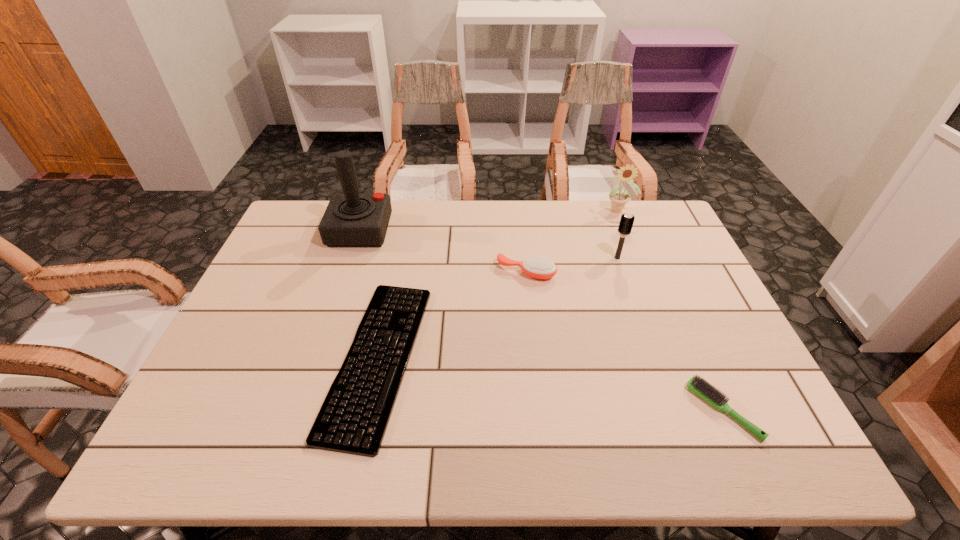
I want to click on blank space located on the front-facing side of the fifth shortest object, so click(x=637, y=258).

This screenshot has height=540, width=960. In order to click on vacant space situated 0.300m on the left of the third tallest object in this screenshot , I will do `click(512, 258)`.

Where is `vacant position located 0.160m on the back of the leftmost hairbrush`? Image resolution: width=960 pixels, height=540 pixels. vacant position located 0.160m on the back of the leftmost hairbrush is located at coordinates (521, 229).

I want to click on free space located 0.350m on the left of the shortest hairbrush, so click(x=534, y=410).

Locate an element on the screen. blank space located 0.330m on the back of the computer keyboard is located at coordinates (407, 219).

This screenshot has width=960, height=540. What are the coordinates of `joystick located at the far edge` in the screenshot? It's located at (351, 219).

The width and height of the screenshot is (960, 540). Find the location of `sunflower situated at the far edge`. sunflower situated at the far edge is located at coordinates (618, 199).

Find the location of `hairbrush that is positioned at the near edge`. hairbrush that is positioned at the near edge is located at coordinates (704, 389).

Where is `computer keyboard located in the near edge section of the desktop`? computer keyboard located in the near edge section of the desktop is located at coordinates (353, 419).

At what (x,y) coordinates should I click in order to perform the action: click on object that is at the left edge. Please return your answer as a coordinate pair (x, y). The height and width of the screenshot is (540, 960). Looking at the image, I should click on (351, 219).